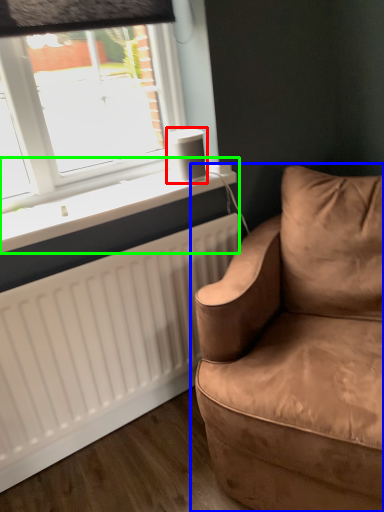
Question: Based on their relative distances, which object is farther from speaker (highlighted by a red box)? Choose from studio couch (highlighted by a blue box) and window sill (highlighted by a green box).

Choices:
 (A) studio couch
 (B) window sill

Answer: (A)